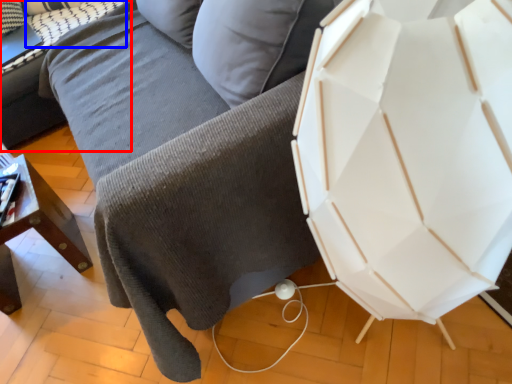
Question: Which object appears closest to the camera in this image, table (highlighted by a red box) or pillow (highlighted by a blue box)?

Choices:
 (A) table
 (B) pillow

Answer: (A)